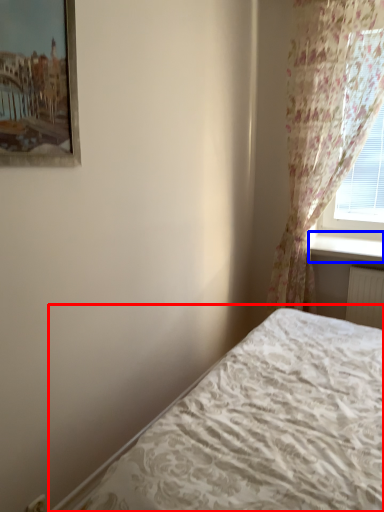
Question: Which point is further to the camera, bed (highlighted by a red box) or window sill (highlighted by a blue box)?

Choices:
 (A) bed
 (B) window sill

Answer: (B)